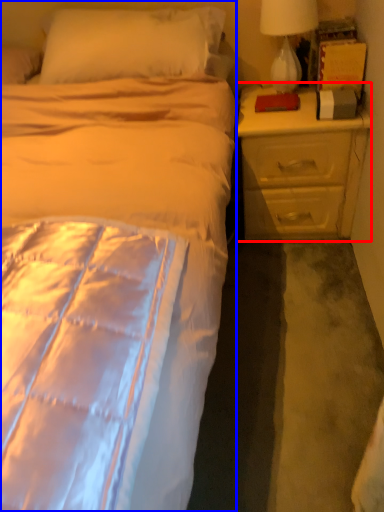
Question: Which object appears closest to the camera in this image, nightstand (highlighted by a red box) or bed (highlighted by a blue box)?

Choices:
 (A) nightstand
 (B) bed

Answer: (B)